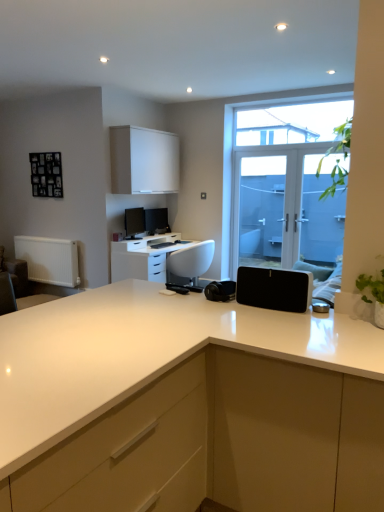
Question: Can you confirm if black matte speaker at center is positioned to the left of matte white cabinet at center, positioned as the 2th cabinetry in top-to-bottom order?

Choices:
 (A) no
 (B) yes

Answer: (B)

Question: Does black matte speaker at center have a lesser height compared to matte white cabinet at center, positioned as the 2th cabinetry in back-to-front order?

Choices:
 (A) yes
 (B) no

Answer: (A)

Question: From the image's perspective, is black matte speaker at center on top of matte white cabinet at center, which is the second cabinetry in left-to-right order?

Choices:
 (A) no
 (B) yes

Answer: (B)

Question: Would you say black matte speaker at center is outside matte white cabinet at center, positioned as the 2th cabinetry in top-to-bottom order?

Choices:
 (A) no
 (B) yes

Answer: (A)

Question: From the image's perspective, is black matte speaker at center beneath matte white cabinet at center, positioned as the 2th cabinetry in back-to-front order?

Choices:
 (A) no
 (B) yes

Answer: (A)

Question: From a real-world perspective, is black matte speaker at center beneath matte white cabinet at center, positioned as the 2th cabinetry in back-to-front order?

Choices:
 (A) no
 (B) yes

Answer: (A)

Question: Would you say white glossy desktop computer at center contains white matte cabinet at upper center, which appears as the first cabinetry when viewed from the top?

Choices:
 (A) no
 (B) yes

Answer: (A)

Question: From the image's perspective, is white glossy desktop computer at center over white matte cabinet at upper center, marked as the 2th cabinetry in a front-to-back arrangement?

Choices:
 (A) yes
 (B) no

Answer: (B)

Question: Is white glossy desktop computer at center outside white matte cabinet at upper center, which is the second cabinetry from bottom to top?

Choices:
 (A) yes
 (B) no

Answer: (A)

Question: Is white glossy desktop computer at center wider than white matte cabinet at upper center, which is the second cabinetry from bottom to top?

Choices:
 (A) yes
 (B) no

Answer: (A)

Question: Is white glossy desktop computer at center touching white matte cabinet at upper center, acting as the 2th cabinetry starting from the right?

Choices:
 (A) no
 (B) yes

Answer: (A)

Question: Is white glossy desktop computer at center at the right side of white matte cabinet at upper center, which appears as the first cabinetry when viewed from the top?

Choices:
 (A) no
 (B) yes

Answer: (B)

Question: Does black matte speaker at center come in front of white glossy desk at center?

Choices:
 (A) yes
 (B) no

Answer: (A)